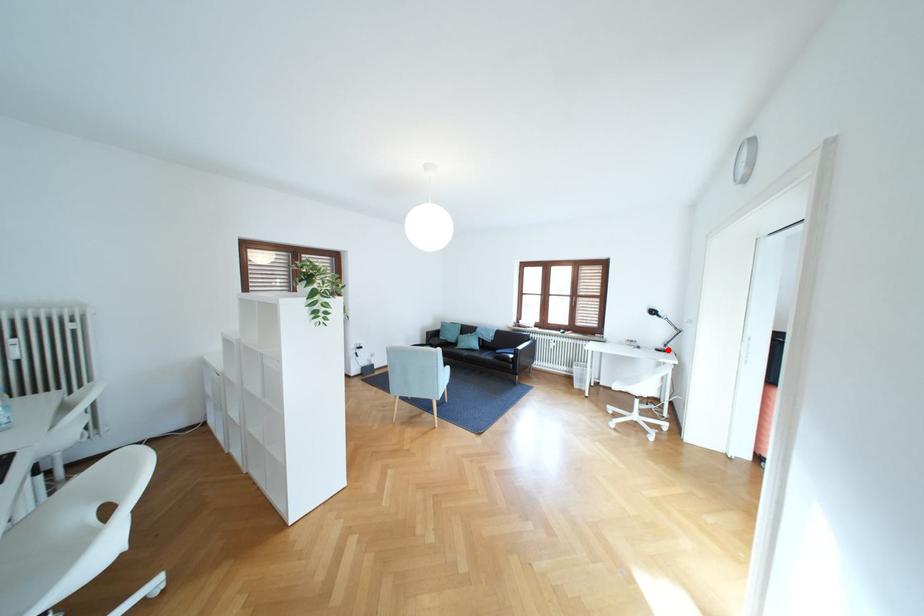
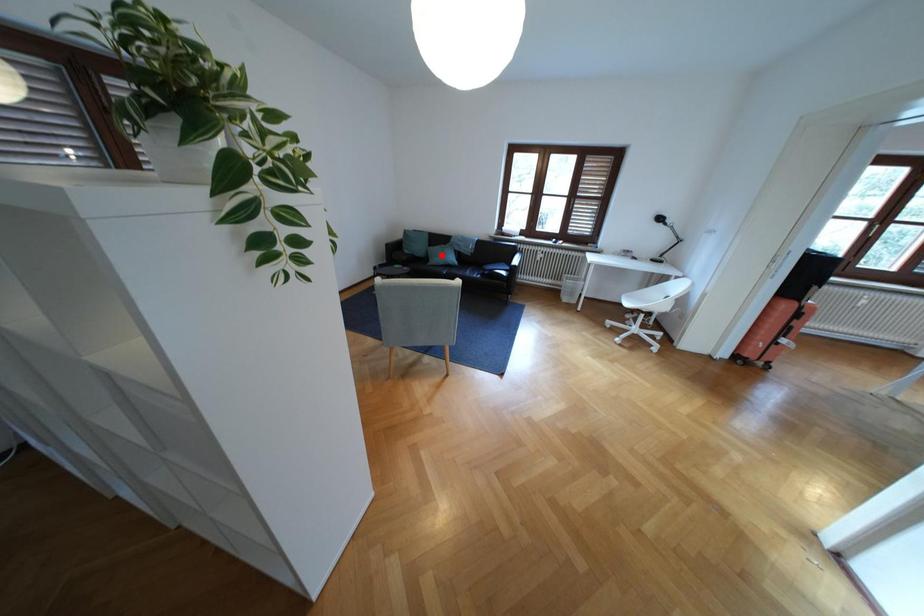
I am providing you with two images of the same scene from different viewpoints. A red point is marked on the first image and another point is marked on the second image. Is the red point in image1 aligned with the point shown in image2?

No